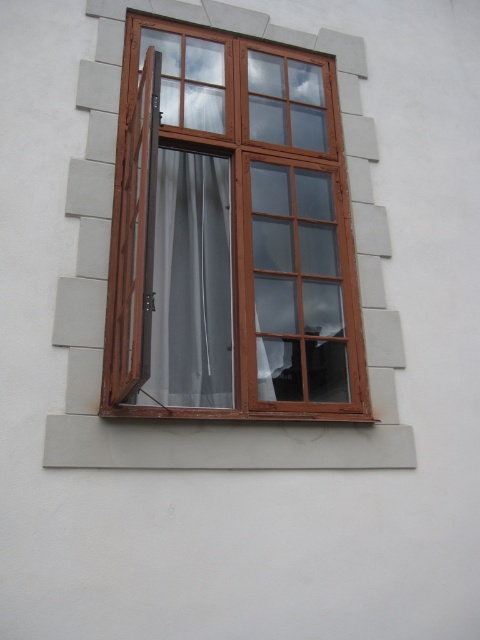
You are a painter trying to hang a 20 cm wide painting on the wall next to the brown wooden window at center and the satin gray curtain at center. Can you fit the painting between them without overlapping either?

The brown wooden window at center and the satin gray curtain at center are 21.85 centimeters apart. Since the painting is 20 cm wide, it can fit between them without overlapping either.

You are trying to hang a new decorative banner that requires at least 2 meters in height. Based on the scene, can the brown wooden window at center and the satin gray curtain at center accommodate this requirement?

The brown wooden window at center has a greater height compared to the satin gray curtain at center. Since the banner requires at least 2 meters in height, you need to check the actual height of the window. If the window is taller than the curtain, it might be suitable, but without specific measurements, it is uncertain.